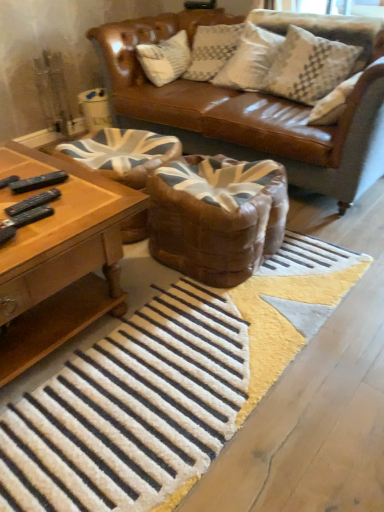
Question: Is brown leather swivel chair at center, the second swivel chair in the left-to-right sequence, located outside white textured rug at center?

Choices:
 (A) yes
 (B) no

Answer: (A)

Question: Can you confirm if brown leather swivel chair at center, which ranks as the 1th swivel chair in right-to-left order, is bigger than white textured rug at center?

Choices:
 (A) yes
 (B) no

Answer: (A)

Question: Considering the relative sizes of brown leather swivel chair at center, the second swivel chair in the left-to-right sequence, and white textured rug at center in the image provided, is brown leather swivel chair at center, the second swivel chair in the left-to-right sequence, shorter than white textured rug at center?

Choices:
 (A) no
 (B) yes

Answer: (A)

Question: Considering the relative sizes of brown leather swivel chair at center, which ranks as the 1th swivel chair in right-to-left order, and white textured rug at center in the image provided, is brown leather swivel chair at center, which ranks as the 1th swivel chair in right-to-left order, wider than white textured rug at center?

Choices:
 (A) no
 (B) yes

Answer: (A)

Question: From a real-world perspective, is brown leather swivel chair at center, the second swivel chair in the left-to-right sequence, below white textured rug at center?

Choices:
 (A) yes
 (B) no

Answer: (B)

Question: From the image's perspective, is brown leather swivel chair at center, the second swivel chair in the left-to-right sequence, below white textured rug at center?

Choices:
 (A) no
 (B) yes

Answer: (A)

Question: Is white textured rug at center outside white textured pillow at upper right?

Choices:
 (A) yes
 (B) no

Answer: (A)

Question: Is white textured rug at center at the left side of white textured pillow at upper right?

Choices:
 (A) yes
 (B) no

Answer: (A)

Question: Is white textured rug at center behind white textured pillow at upper right?

Choices:
 (A) no
 (B) yes

Answer: (A)

Question: From the image's perspective, does white textured rug at center appear higher than white textured pillow at upper right?

Choices:
 (A) no
 (B) yes

Answer: (A)

Question: Can you confirm if white textured rug at center is wider than white textured pillow at upper right?

Choices:
 (A) no
 (B) yes

Answer: (B)

Question: Could you tell me if white textured rug at center is turned towards white textured pillow at upper right?

Choices:
 (A) no
 (B) yes

Answer: (A)

Question: From a real-world perspective, is white textured pillow at upper right under brown leather swivel chair at center, which ranks as the 1th swivel chair in right-to-left order?

Choices:
 (A) no
 (B) yes

Answer: (A)